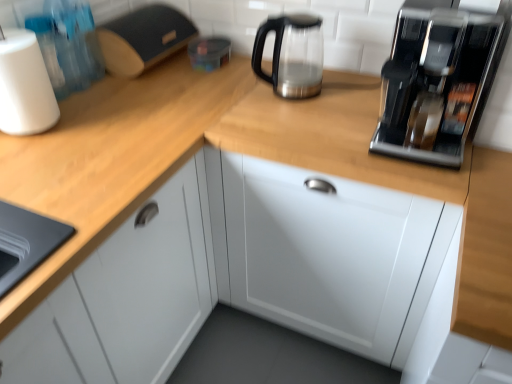
You are a GUI agent. You are given a task and a screenshot of the screen. Output one action in this format:
    pyautogui.click(x=<x>, y=<y>)
    Task: Click on the vacant area in front of satin metallic kettle at upper center
    This screenshot has width=512, height=384.
    Given the screenshot: What is the action you would take?
    pyautogui.click(x=291, y=108)